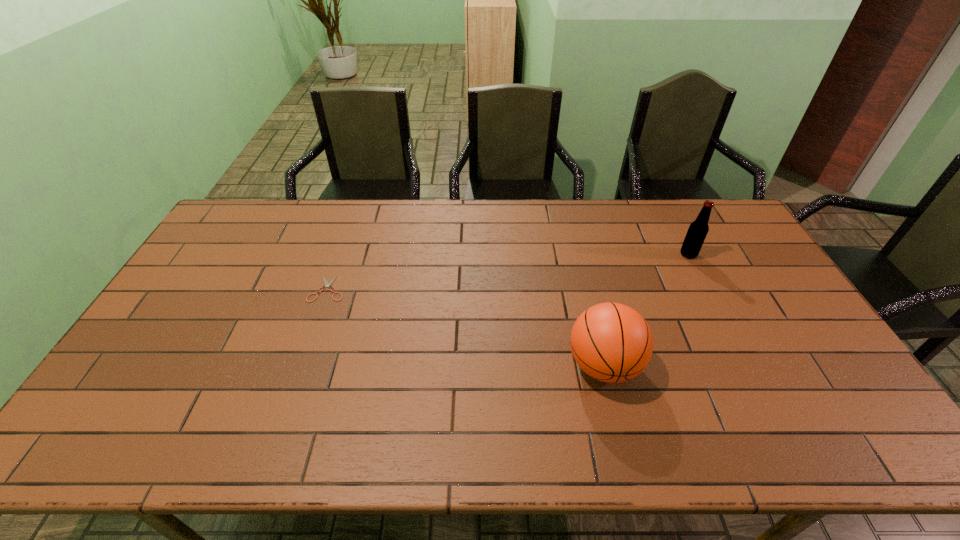
Locate an element on the screen. beer bottle is located at coordinates (698, 229).

Locate an element on the screen. the rightmost object is located at coordinates (698, 229).

Where is `basketball`? This screenshot has height=540, width=960. basketball is located at coordinates (611, 342).

This screenshot has width=960, height=540. In order to click on the second object from left to right in this screenshot , I will do `click(611, 342)`.

This screenshot has width=960, height=540. What are the coordinates of `the leftmost object` in the screenshot? It's located at (326, 283).

Identify the location of the shortest object. (326, 283).

Where is `blank area located 0.120m on the right of the farthest object`? This screenshot has height=540, width=960. blank area located 0.120m on the right of the farthest object is located at coordinates (732, 254).

Identify the location of blank area located 0.140m on the front of the basketball. (625, 454).

Locate an element on the screen. This screenshot has width=960, height=540. vacant space located 0.220m on the right of the leftmost object is located at coordinates (416, 289).

Locate an element on the screen. free space at the far edge of the desktop is located at coordinates (548, 228).